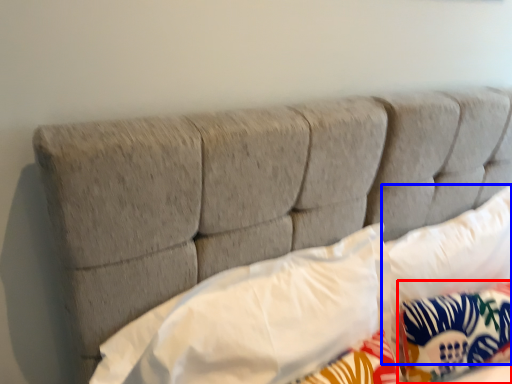
Question: Which object appears closest to the camera in this image, pillow (highlighted by a red box) or pillow (highlighted by a blue box)?

Choices:
 (A) pillow
 (B) pillow

Answer: (B)